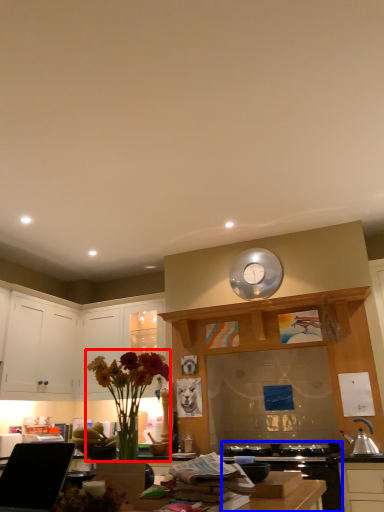
Question: Which object appears closest to the camera in this image, floral arrangement (highlighted by a red box) or appliance (highlighted by a blue box)?

Choices:
 (A) floral arrangement
 (B) appliance

Answer: (A)